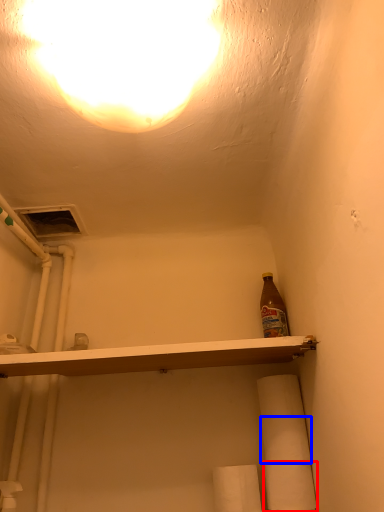
Question: Which point is further to the camera, toilet paper (highlighted by a red box) or toilet paper (highlighted by a blue box)?

Choices:
 (A) toilet paper
 (B) toilet paper

Answer: (B)